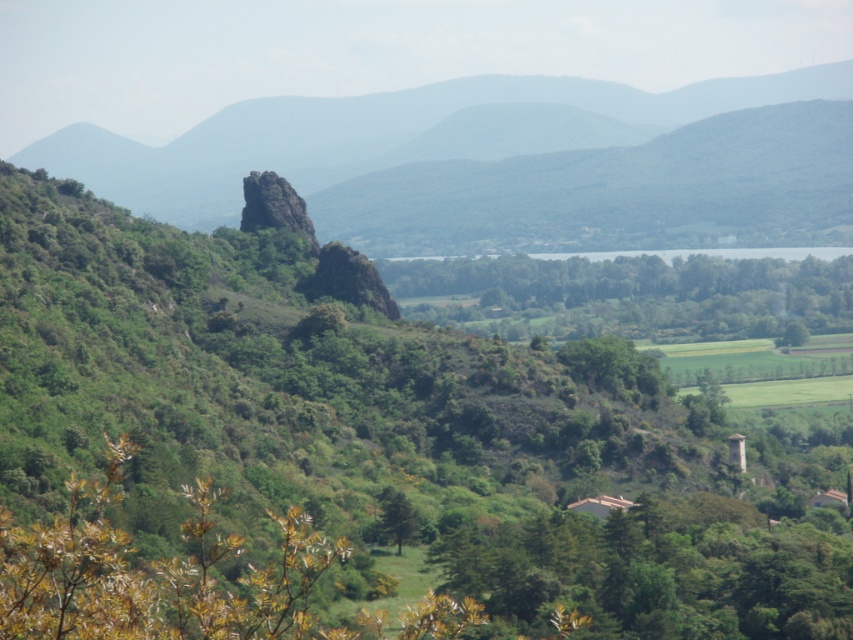
Does green matte tree at center come behind green leafy tree at lower right?

No, it is not.

Can you confirm if green matte tree at center is positioned to the left of green leafy tree at lower right?

Correct, you'll find green matte tree at center to the left of green leafy tree at lower right.

Is point (393, 515) positioned in front of point (788, 330)?

Yes, point (393, 515) is closer to viewer.

Where is `green matte tree at center`? The image size is (853, 640). green matte tree at center is located at coordinates (395, 518).

Is rugged stone mountain at center taller than green matte tree at center?

Correct, rugged stone mountain at center is much taller as green matte tree at center.

Is point (778, 134) positioned after point (398, 554)?

Yes, it is.

You are a GUI agent. You are given a task and a screenshot of the screen. Output one action in this format:
    pyautogui.click(x=<x>, y=<y>)
    Task: Click on the rugged stone mountain at center
    This screenshot has width=853, height=640.
    Given the screenshot: What is the action you would take?
    pyautogui.click(x=508, y=164)

Looking at this image, can you confirm if rough stone rock at center is positioned to the left of green leafy tree at lower right?

Yes, rough stone rock at center is to the left of green leafy tree at lower right.

Is point (260, 216) positioned before point (782, 337)?

Yes, it is.

Where is `rough stone rock at center`? The image size is (853, 640). rough stone rock at center is located at coordinates (274, 205).